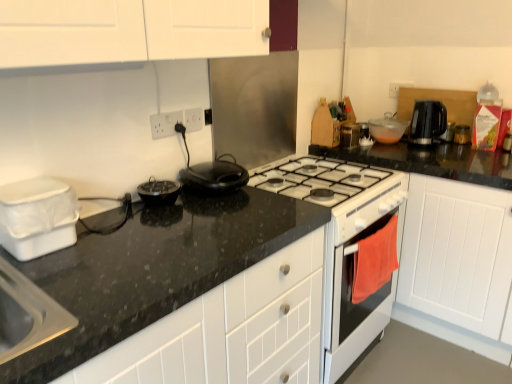
The width and height of the screenshot is (512, 384). In order to click on free region under black matte waffle maker at center, arranged as the 5th kitchen appliance when viewed from the back (from a real-world perspective) in this screenshot , I will do `click(222, 193)`.